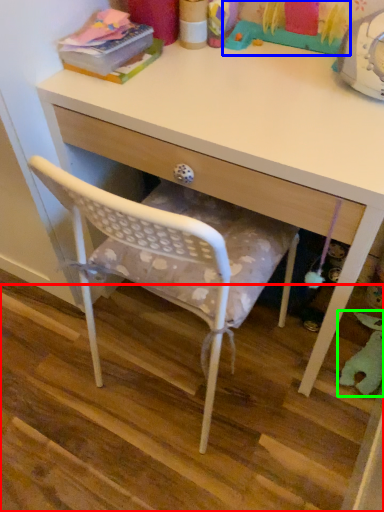
Question: Based on their relative distances, which object is farther from stair (highlighted by a red box)? Choose from toy (highlighted by a blue box) and toy (highlighted by a green box).

Choices:
 (A) toy
 (B) toy

Answer: (A)